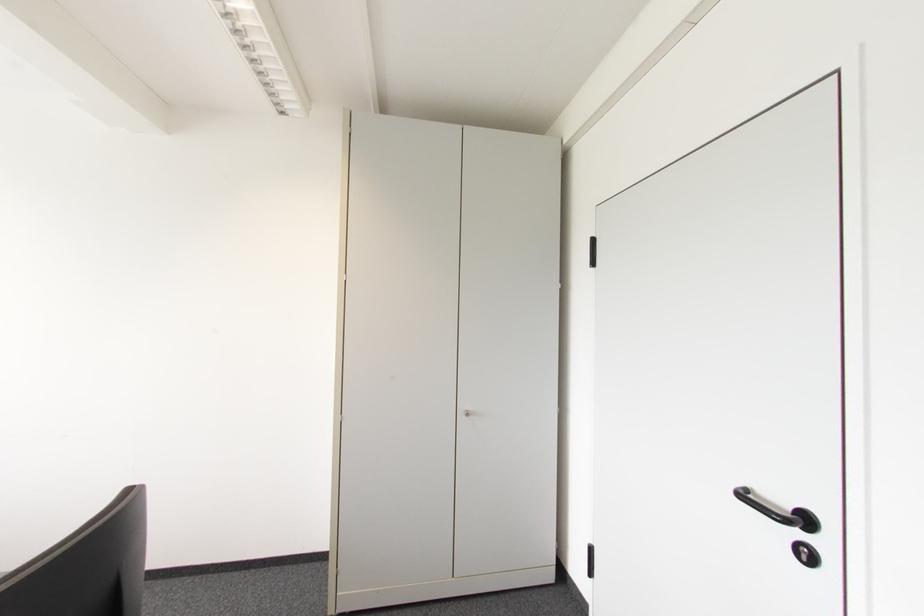
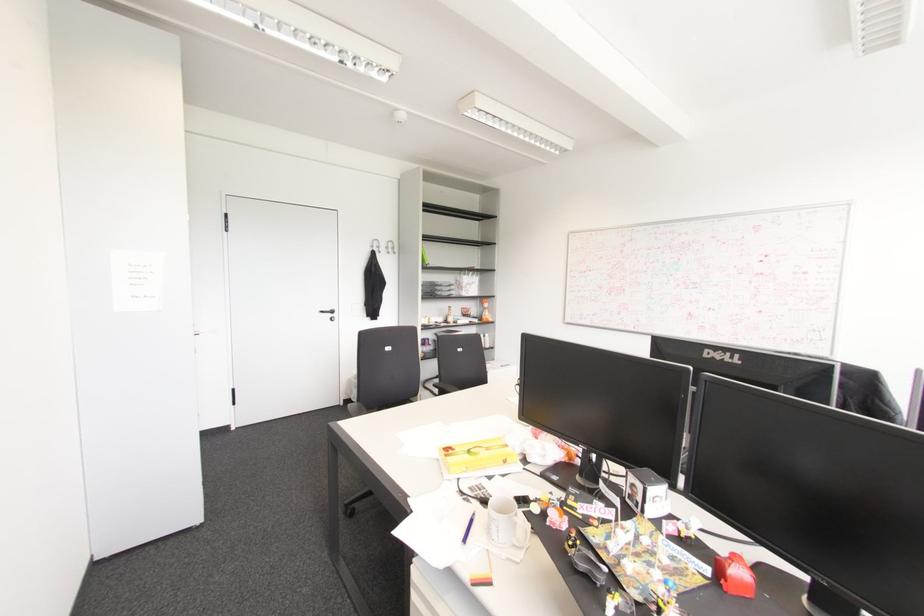
Locate, in the second image, the point that corresponds to (805,521) in the first image.

(332, 310)